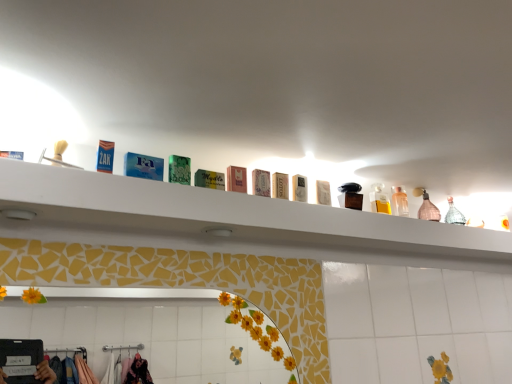
Question: Considering the positions of blue cardboard box at upper left, arranged as the first toiletry when viewed from the front, and pink glass bottle at upper right in the image, is blue cardboard box at upper left, arranged as the first toiletry when viewed from the front, wider or thinner than pink glass bottle at upper right?

Choices:
 (A) wide
 (B) thin

Answer: (B)

Question: Visually, is blue cardboard box at upper left, marked as the first toiletry in a left-to-right arrangement, positioned to the left or to the right of pink glass bottle at upper right?

Choices:
 (A) right
 (B) left

Answer: (B)

Question: Which is farther from the white cardboard box at center, acting as the 4th toiletry starting from the front?

Choices:
 (A) pink glass bottle at upper right
 (B) white matte soap at center, the 2th toiletry when ordered from back to front
 (C) blue cardboard box at upper left, positioned as the eighth toiletry in back-to-front order
 (D) clear plastic bottle at upper right, the 8th toiletry positioned from the front
 (E) matte pink soap at center, which ranks as the third toiletry in front-to-back order

Answer: (A)

Question: Estimate the real-world distances between objects in this image. Which object is closer to the white cardboard box at center, acting as the 4th toiletry starting from the front?

Choices:
 (A) pink glass bottle at upper right
 (B) clear plastic bottle at upper center
 (C) clear plastic bottle at upper right, the 1th toiletry positioned from the right
 (D) green matte soap at center, the 2th toiletry in the front-to-back sequence
 (E) white matte shelf at upper center

Answer: (D)